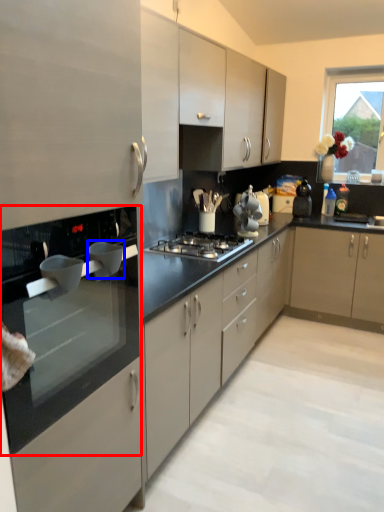
Question: Which point is closer to the camera, countertop (highlighted by a red box) or appliance (highlighted by a blue box)?

Choices:
 (A) countertop
 (B) appliance

Answer: (A)